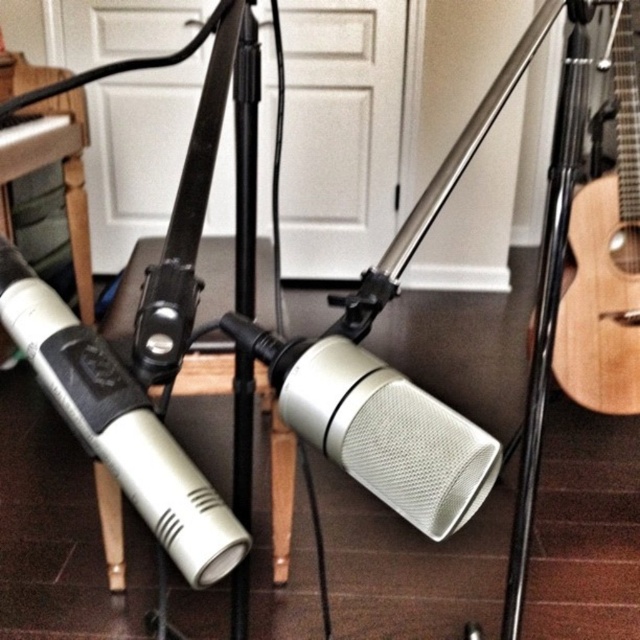
Consider the image. You are setting up a recording studio and need to place two microphones exactly 15 centimeters apart. You have the silver mesh microphone at center and the silver metallic microphone at left. Can you determine if their current spacing meets the requirement?

The silver mesh microphone at center and the silver metallic microphone at left are currently 12.79 centimeters apart, which is less than the required 15 centimeters. Therefore, they do not meet the spacing requirement.

You are a sound engineer setting up for a recording session. You need to ensure that the silver mesh microphone at center is positioned exactly 40 centimeters away from the camera. Based on the current setup shown in the image, is the microphone too close or too far?

The silver mesh microphone at center is currently 37.97 centimeters from the camera, which is closer than the required 40 centimeters. Therefore, it is too close and needs to be moved back approximately 2.03 centimeters to meet the desired distance.

You are a sound engineer setting up for a recording session. You need to adjust the microphones so that the one closer to you can capture a singer better. Which microphone should you focus on adjusting? The silver mesh microphone at center or the silver metallic microphone at left?

The silver mesh microphone at center is closer to the viewer, so you should focus on adjusting the silver mesh microphone at center to capture the singer better.